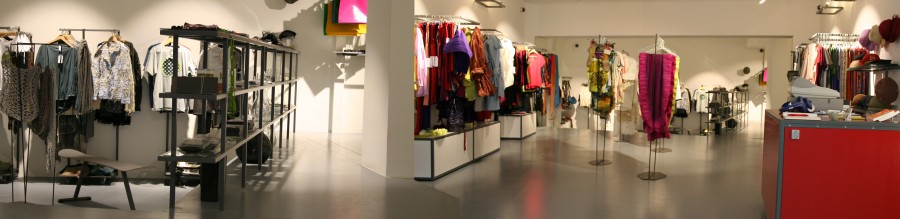
Where is `rack of blouses`? This screenshot has height=219, width=900. rack of blouses is located at coordinates (832, 59).